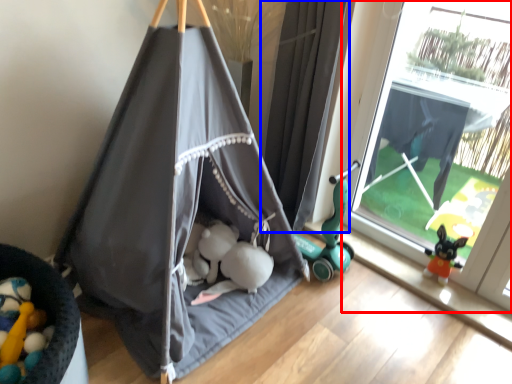
Question: Which of the following is the closest to the observer, window (highlighted by a red box) or curtain (highlighted by a blue box)?

Choices:
 (A) window
 (B) curtain

Answer: (A)